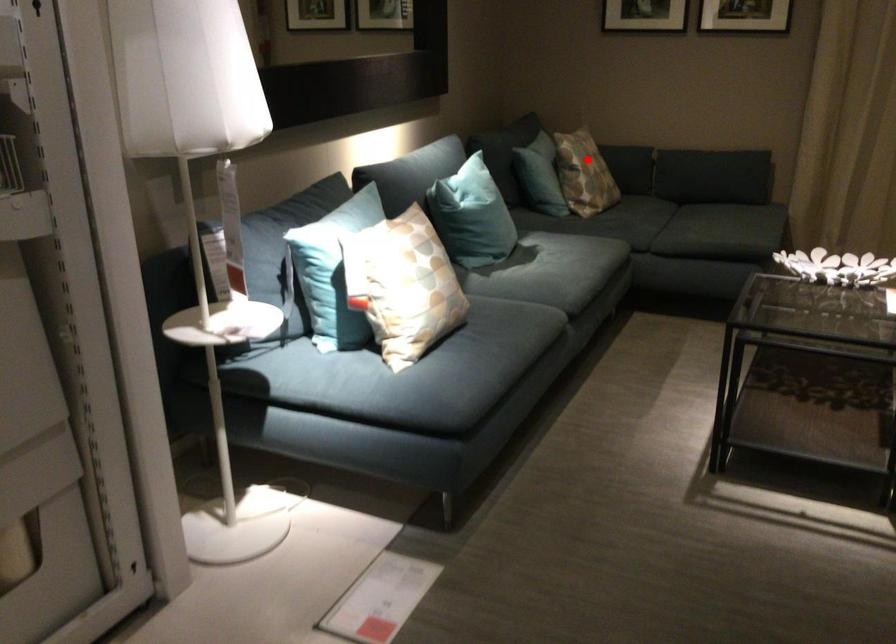
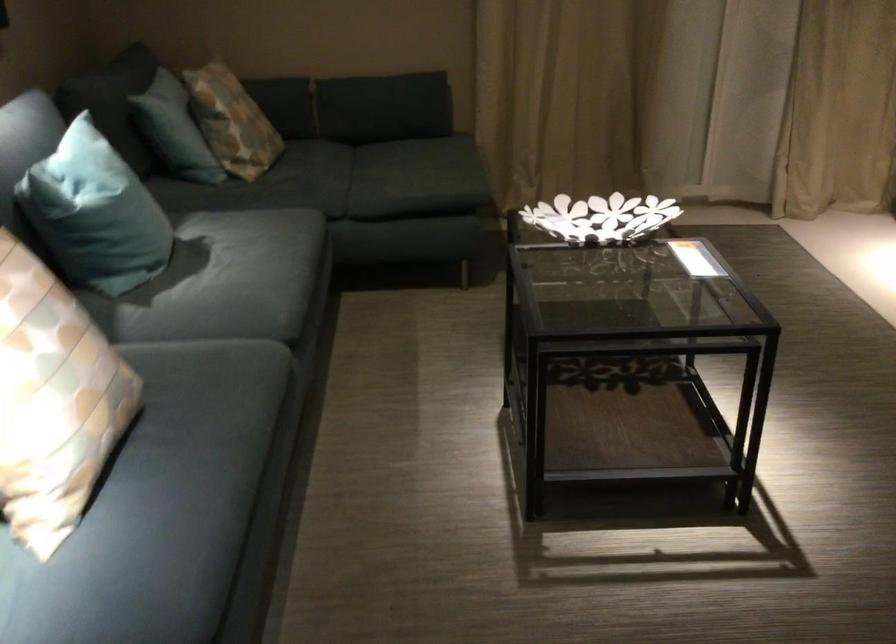
Where in the second image is the point corresponding to the highlighted location from the first image?

(231, 120)